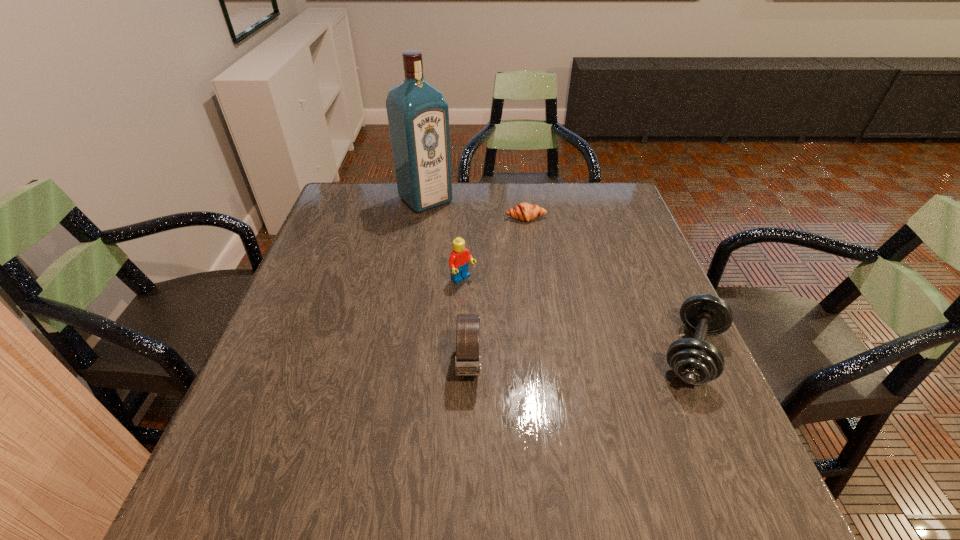
Locate an element on the screen. This screenshot has width=960, height=540. free region located 0.230m on the front-facing side of the second object from right to left is located at coordinates (544, 276).

Where is `vacant area situated 0.210m on the front-facing side of the second object from right to left`? The image size is (960, 540). vacant area situated 0.210m on the front-facing side of the second object from right to left is located at coordinates (542, 271).

The height and width of the screenshot is (540, 960). I want to click on vacant space located on the front-facing side of the second object from right to left, so click(x=550, y=295).

In order to click on free location located on the flat label side of the tallest object in this screenshot , I will do `click(485, 254)`.

You are a GUI agent. You are given a task and a screenshot of the screen. Output one action in this format:
    pyautogui.click(x=<x>, y=<y>)
    Task: Click on the free space located on the flat label side of the tallest object
    This screenshot has width=960, height=540.
    Given the screenshot: What is the action you would take?
    pyautogui.click(x=467, y=237)

Locate an element on the screen. free region located on the flat label side of the tallest object is located at coordinates (497, 266).

I want to click on free point located 0.280m on the face of the Lego, so click(558, 355).

Locate an element on the screen. The image size is (960, 540). vacant region located 0.180m on the face of the Lego is located at coordinates (523, 328).

What are the coordinates of `vacant point located 0.360m on the face of the Lego` in the screenshot? It's located at (588, 379).

In order to click on pastry located at the far edge in this screenshot , I will do `click(524, 211)`.